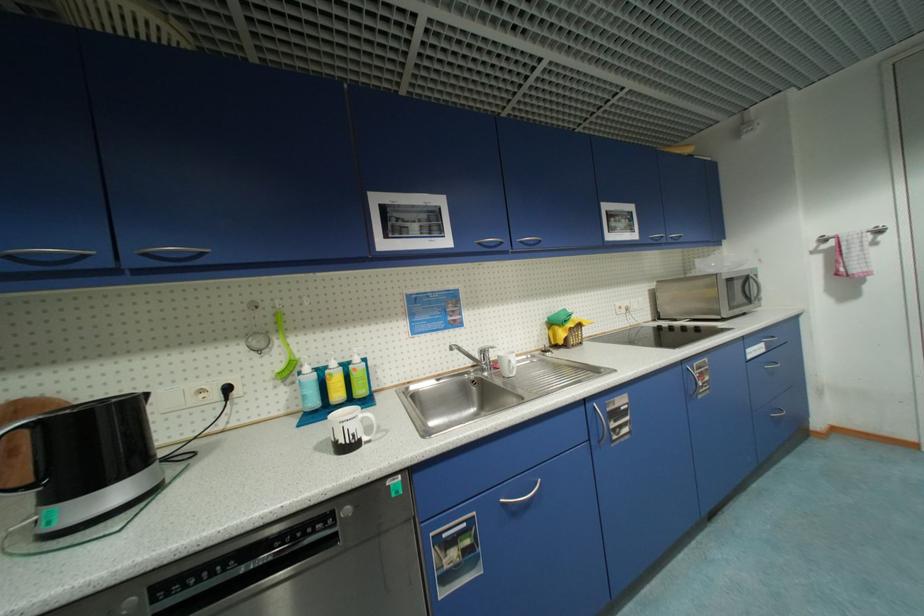
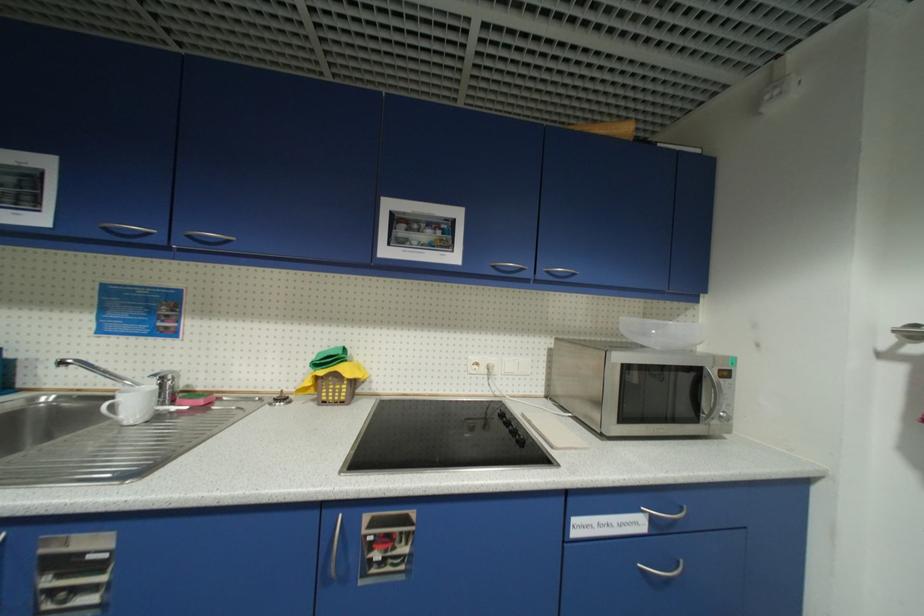
In a continuous first-person perspective shot, in which direction is the camera moving?

The movement direction of the cameraman is right, forward.